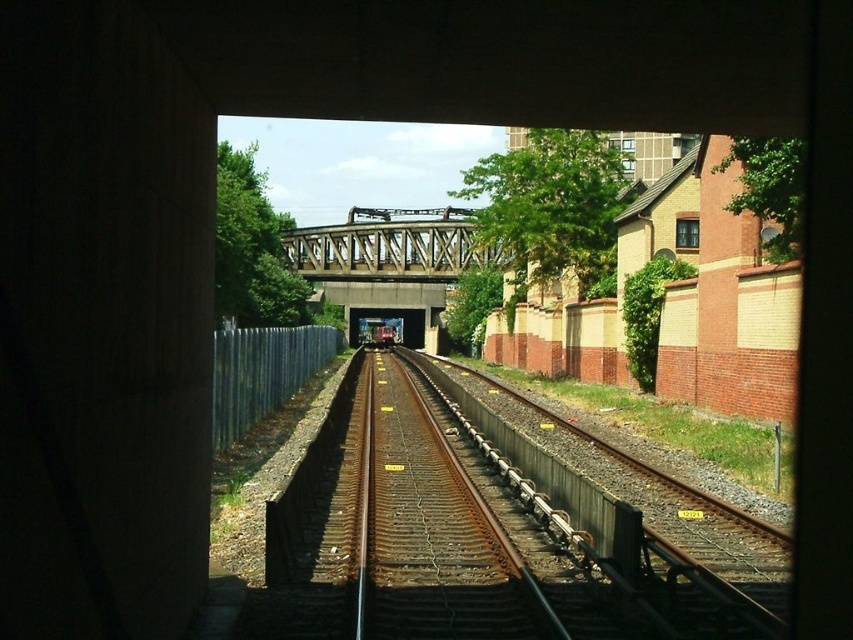
You are a railway inspector checking the tunnel exit. You see the rusty metal train track at center and the galvanized metal fence at center. Which object is narrower in width?

The rusty metal train track at center is thinner than the galvanized metal fence at center, so the rusty metal train track at center is narrower in width.